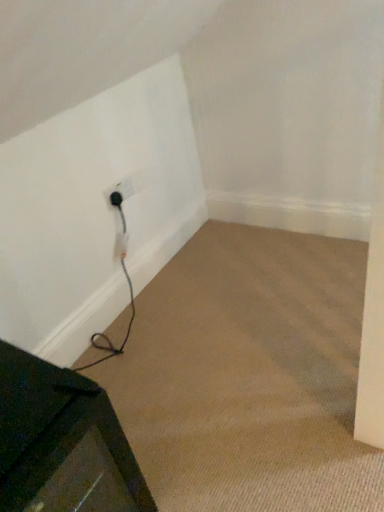
Question: From a real-world perspective, is black rubber plug at lower left under black plastic outlet at lower left?

Choices:
 (A) no
 (B) yes

Answer: (A)

Question: Does black rubber plug at lower left contain black plastic outlet at lower left?

Choices:
 (A) no
 (B) yes

Answer: (A)

Question: Is black rubber plug at lower left at the right side of black plastic outlet at lower left?

Choices:
 (A) no
 (B) yes

Answer: (B)

Question: Is black rubber plug at lower left oriented away from black plastic outlet at lower left?

Choices:
 (A) yes
 (B) no

Answer: (A)

Question: Considering the relative positions of black rubber plug at lower left and black plastic outlet at lower left in the image provided, is black rubber plug at lower left behind black plastic outlet at lower left?

Choices:
 (A) yes
 (B) no

Answer: (A)

Question: Is black rubber plug at lower left shorter than black plastic outlet at lower left?

Choices:
 (A) yes
 (B) no

Answer: (A)

Question: Considering the relative sizes of metallic dark green table at lower left and black plastic outlet at lower left in the image provided, is metallic dark green table at lower left bigger than black plastic outlet at lower left?

Choices:
 (A) no
 (B) yes

Answer: (B)

Question: Does metallic dark green table at lower left appear on the right side of black plastic outlet at lower left?

Choices:
 (A) no
 (B) yes

Answer: (A)

Question: Does metallic dark green table at lower left have a greater width compared to black plastic outlet at lower left?

Choices:
 (A) no
 (B) yes

Answer: (B)

Question: From the image's perspective, is metallic dark green table at lower left under black plastic outlet at lower left?

Choices:
 (A) no
 (B) yes

Answer: (B)

Question: Does metallic dark green table at lower left have a lesser width compared to black plastic outlet at lower left?

Choices:
 (A) no
 (B) yes

Answer: (A)

Question: Is metallic dark green table at lower left at the left side of black plastic outlet at lower left?

Choices:
 (A) no
 (B) yes

Answer: (B)

Question: From the image's perspective, does metallic dark green table at lower left appear lower than black rubber plug at lower left?

Choices:
 (A) no
 (B) yes

Answer: (B)